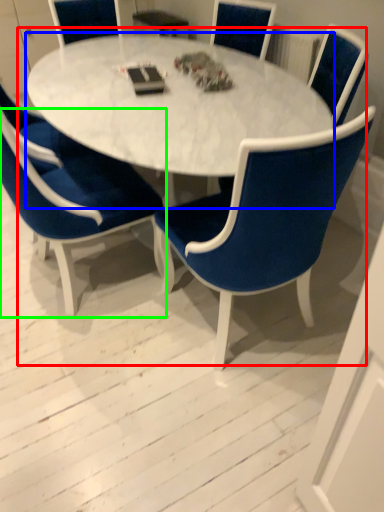
Question: Based on their relative distances, which object is nearer to kitchen & dining room table (highlighted by a red box)? Choose from coffee table (highlighted by a blue box) and chair (highlighted by a green box).

Choices:
 (A) coffee table
 (B) chair

Answer: (A)